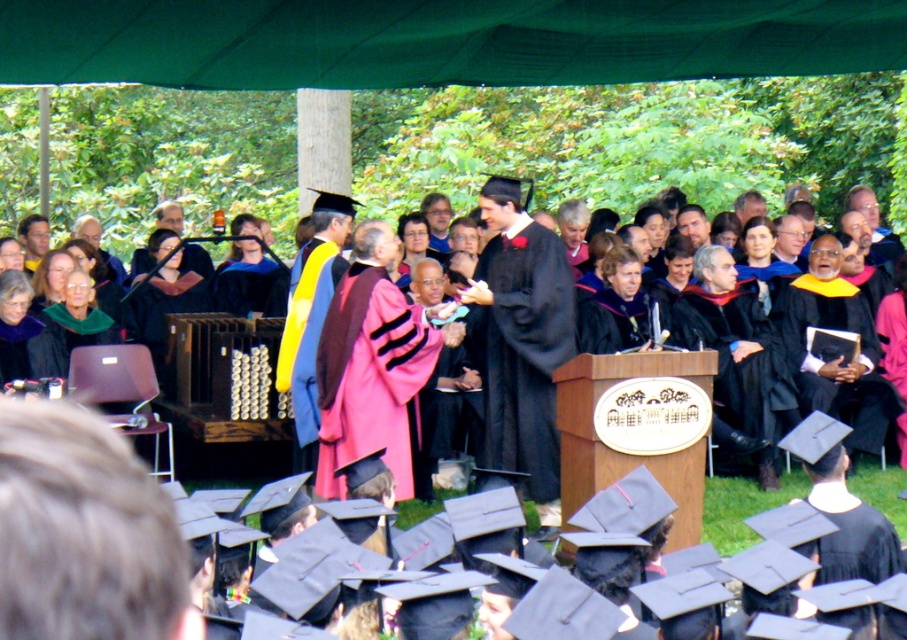
Question: Is pink velvet gown at center further to camera compared to matte black graduation gown at center?

Choices:
 (A) yes
 (B) no

Answer: (A)

Question: From the image, what is the correct spatial relationship of pink velvet gown at center in relation to pink velvet robe at center?

Choices:
 (A) left
 (B) right

Answer: (B)

Question: Where is pink velvet gown at center located in relation to matte black graduation gown at center in the image?

Choices:
 (A) right
 (B) left

Answer: (B)

Question: Which point is closer to the camera?

Choices:
 (A) (129, 371)
 (B) (545, 262)
 (C) (431, 310)

Answer: (B)

Question: Which of the following is the closest to the observer?

Choices:
 (A) pink velvet robe at center
 (B) matte black graduation gown at center
 (C) pink velvet gown at center

Answer: (A)

Question: Which object is positioned closest to the matte black graduation gown at center?

Choices:
 (A) pink velvet gown at center
 (B) pink velvet robe at center

Answer: (B)